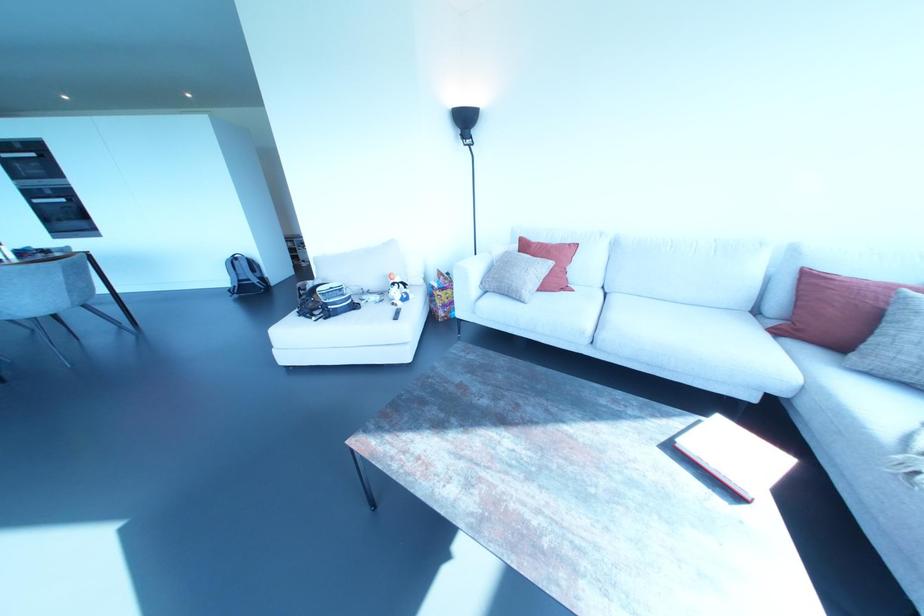
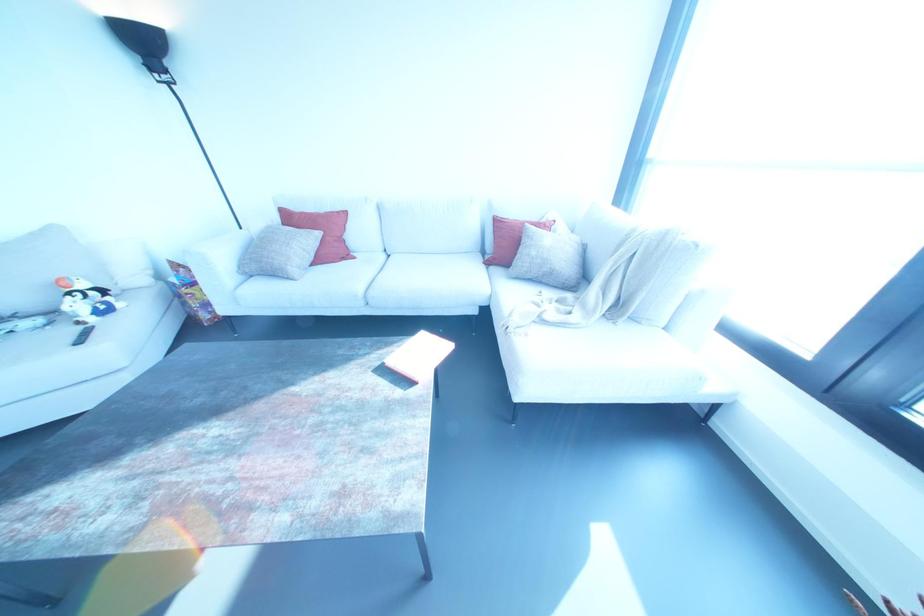
In the second image, find the point that corresponds to point 436,292 in the first image.

(184, 290)